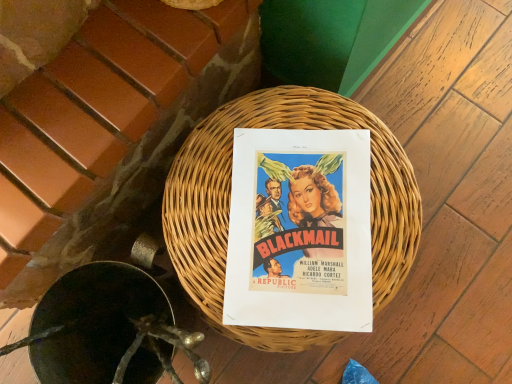
You are a GUI agent. You are given a task and a screenshot of the screen. Output one action in this format:
    pyautogui.click(x=<x>, y=<y>)
    Task: Click on the vacant region above matte paper poster at center (from a real-world perspective)
    The height and width of the screenshot is (384, 512).
    Given the screenshot: What is the action you would take?
    pyautogui.click(x=302, y=231)